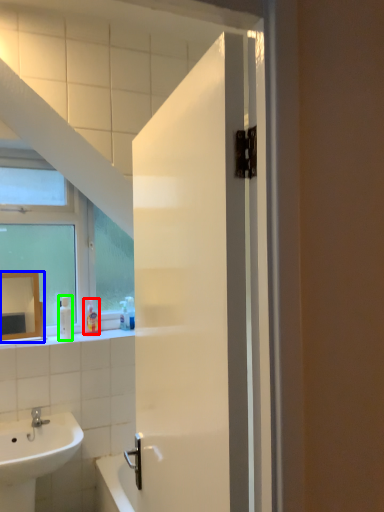
Question: Which object is the closest to the toiletry (highlighted by a red box)? Choose among these: mirror (highlighted by a blue box) or soap dispenser (highlighted by a green box).

Choices:
 (A) mirror
 (B) soap dispenser

Answer: (B)